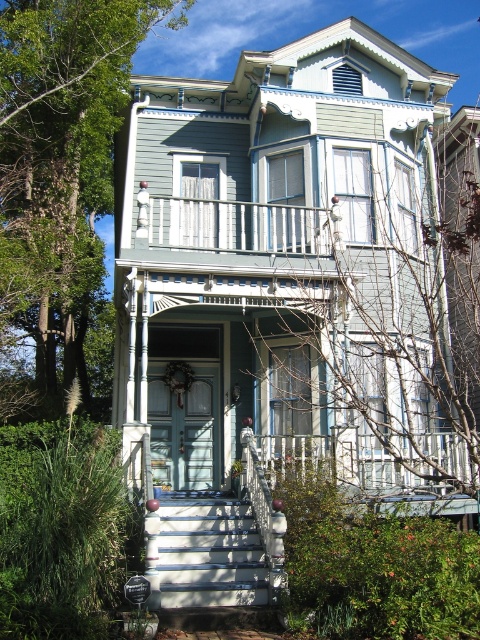
Who is lower down, white painted wood stairs at center or metallic silver balustrade at upper center?

Positioned lower is white painted wood stairs at center.

Is point (210, 588) in front of point (168, 225)?

Yes, it is.

Between point (172, 556) and point (156, 209), which one is positioned behind?

The point (156, 209) is more distant.

Locate an element on the screen. The width and height of the screenshot is (480, 640). white painted wood stairs at center is located at coordinates (204, 552).